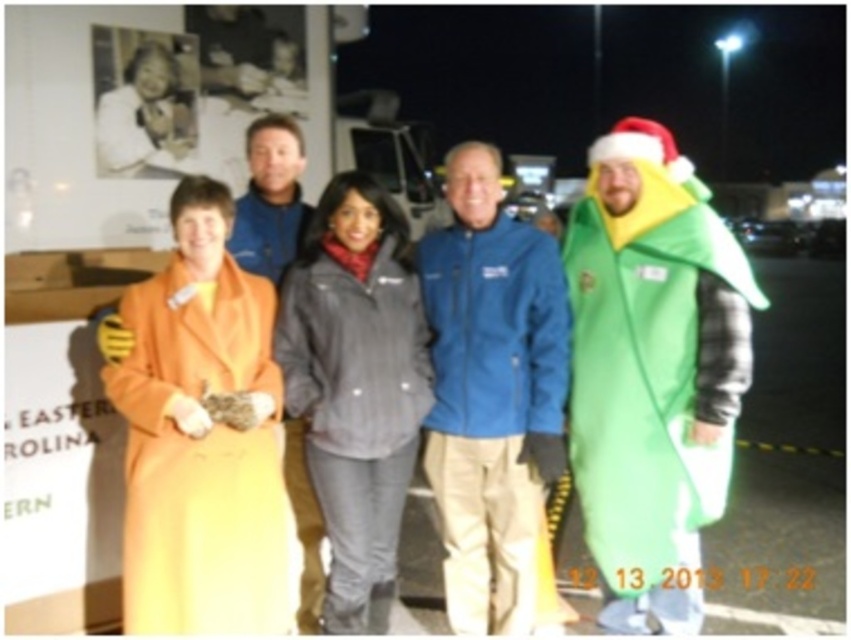
Question: Is blue softshell jacket at center above orange woolen coat at left?

Choices:
 (A) no
 (B) yes

Answer: (B)

Question: Considering the relative positions of blue softshell jacket at center and orange woolen coat at left in the image provided, where is blue softshell jacket at center located with respect to orange woolen coat at left?

Choices:
 (A) above
 (B) below

Answer: (A)

Question: Can you confirm if orange woolen coat at left is positioned above blue fleece jacket at center?

Choices:
 (A) yes
 (B) no

Answer: (B)

Question: Which object appears farthest from the camera in this image?

Choices:
 (A) blue fleece jacket at center
 (B) orange woolen coat at left
 (C) gray synthetic jacket at center

Answer: (A)

Question: Which object is the farthest from the orange woolen coat at left?

Choices:
 (A) blue fleece jacket at center
 (B) gray synthetic jacket at center
 (C) green fuzzy onesie at right
 (D) blue softshell jacket at center

Answer: (C)

Question: Among these objects, which one is farthest from the camera?

Choices:
 (A) gray synthetic jacket at center
 (B) orange woolen coat at left
 (C) blue softshell jacket at center

Answer: (C)